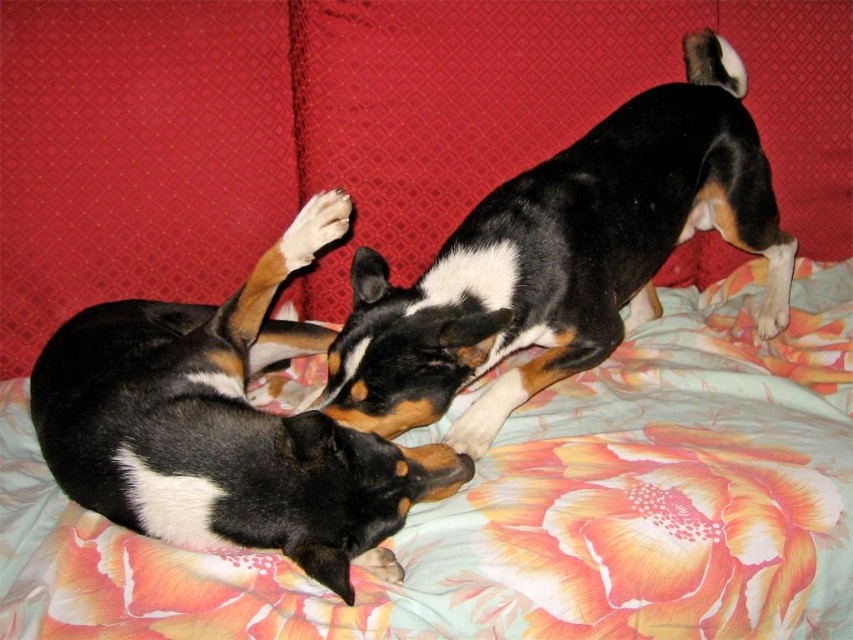
Is floral fabric bedspread at center thinner than black and white fur at center?

Incorrect, floral fabric bedspread at center's width is not less than black and white fur at center's.

Between point (293, 611) and point (325, 488), which one is positioned in front?

Point (293, 611)

You are a GUI agent. You are given a task and a screenshot of the screen. Output one action in this format:
    pyautogui.click(x=<x>, y=<y>)
    Task: Click on the floral fabric bedspread at center
    Image resolution: width=853 pixels, height=640 pixels.
    Given the screenshot: What is the action you would take?
    pyautogui.click(x=532, y=508)

Between floral fabric bedspread at center and white soft paw at center, which one is positioned higher?

white soft paw at center is above.

Does point (619, 580) come farther from viewer compared to point (300, 225)?

No, (619, 580) is closer to viewer.

Between point (57, 596) and point (329, 241), which one is positioned behind?

Point (329, 241)

The width and height of the screenshot is (853, 640). Find the location of `floral fabric bedspread at center`. floral fabric bedspread at center is located at coordinates (532, 508).

Between floral fabric bedspread at center and black and white fur at upper center, which one is positioned higher?

black and white fur at upper center is higher up.

Which is more to the right, floral fabric bedspread at center or black and white fur at upper center?

black and white fur at upper center

This screenshot has height=640, width=853. What do you see at coordinates (532, 508) in the screenshot?
I see `floral fabric bedspread at center` at bounding box center [532, 508].

Where is `floral fabric bedspread at center`? The height and width of the screenshot is (640, 853). floral fabric bedspread at center is located at coordinates tap(532, 508).